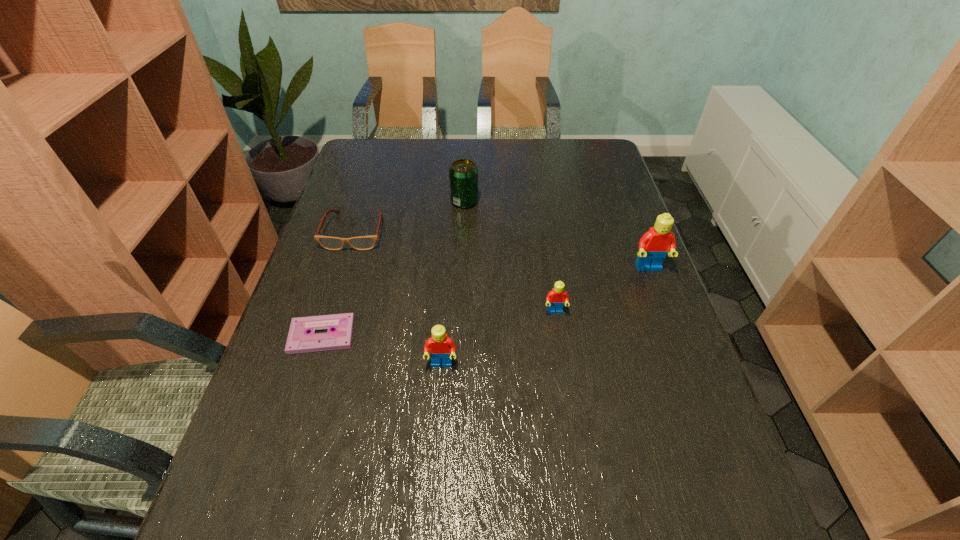
All Legos are currently evenly spaced. To continue this pattern, where would you add another Lego on the left? Please point out a vacant spot. Please provide its 2D coordinates. Your answer should be formatted as a tuple, i.e. [(x, y)], where the tuple contains the x and y coordinates of a point satisfying the conditions above.

[(300, 429)]